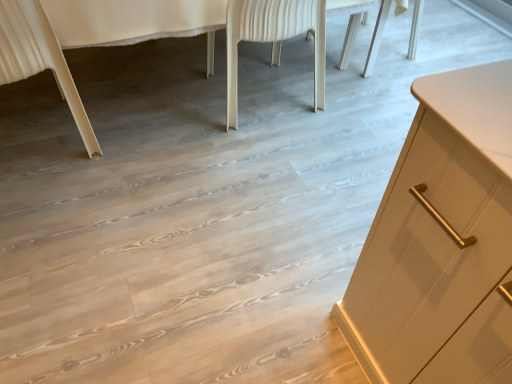
Identify the location of free space to the left of white wood chair at center, marked as the 1th chair in a right-to-left arrangement. Image resolution: width=512 pixels, height=384 pixels. (159, 91).